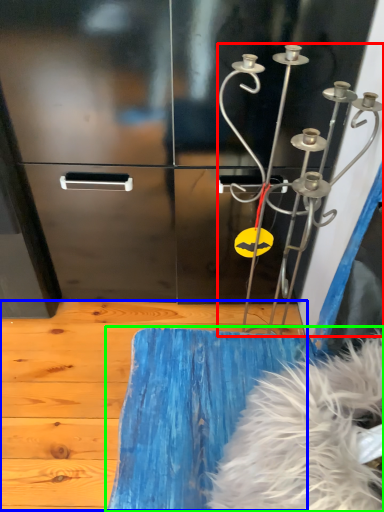
Question: Which is farther away from wind chime (highlighted by a red box)? plywood (highlighted by a blue box) or furniture (highlighted by a green box)?

Choices:
 (A) plywood
 (B) furniture

Answer: (A)